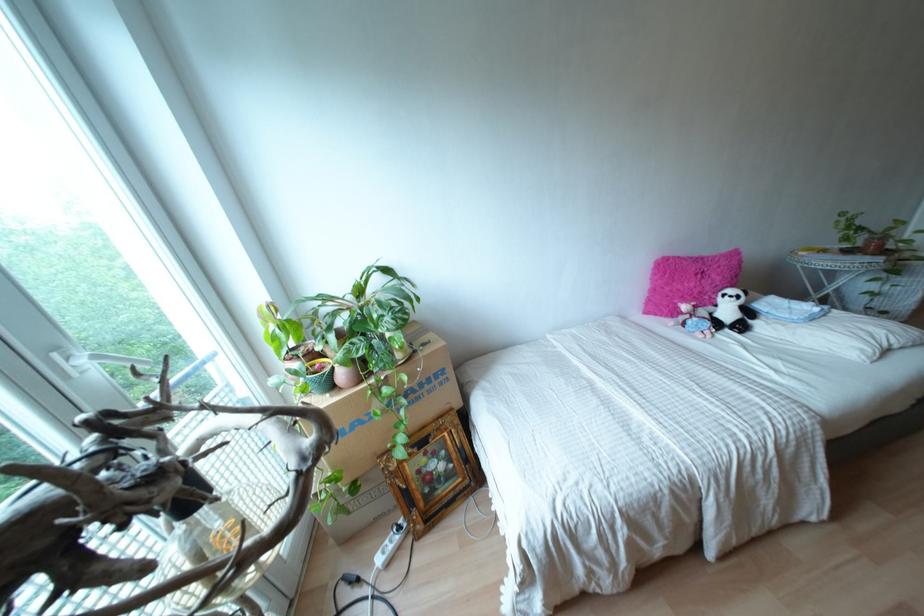
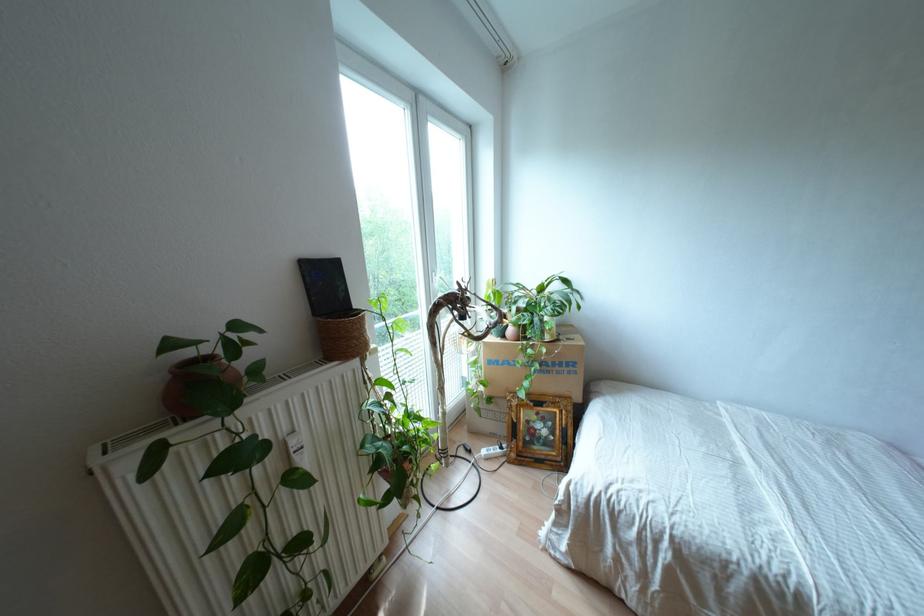
The point at (x=396, y=535) is marked in the first image. Where is the corresponding point in the second image?

(497, 450)